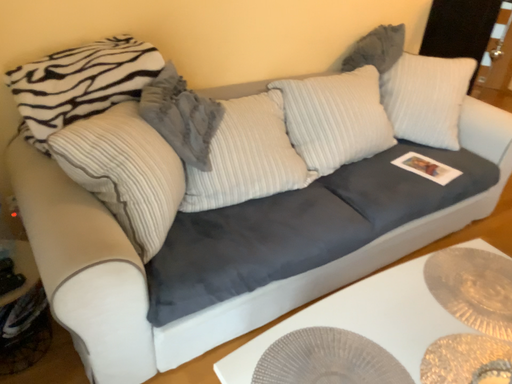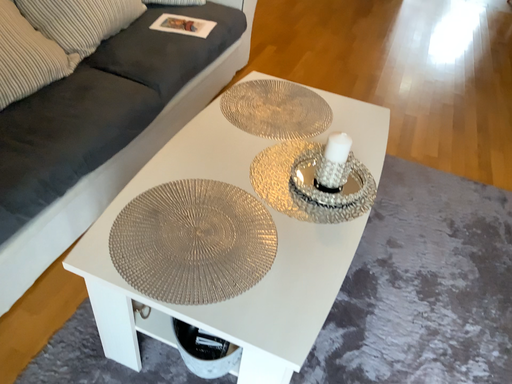
Question: Which way did the camera rotate in the video?

Choices:
 (A) rotated downward
 (B) rotated upward

Answer: (A)